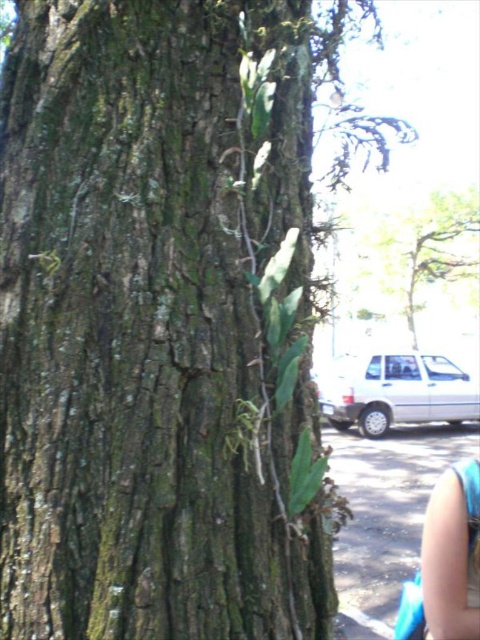
Which is more to the right, green rough bark at center or blue fabric arm at lower right?

blue fabric arm at lower right

This screenshot has height=640, width=480. Find the location of `green rough bark at center`. green rough bark at center is located at coordinates (149, 324).